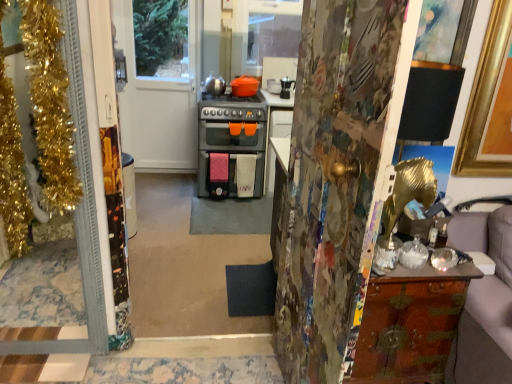
The width and height of the screenshot is (512, 384). I want to click on vacant area on top of wooden cabinet at right (from a real-world perspective), so click(x=417, y=246).